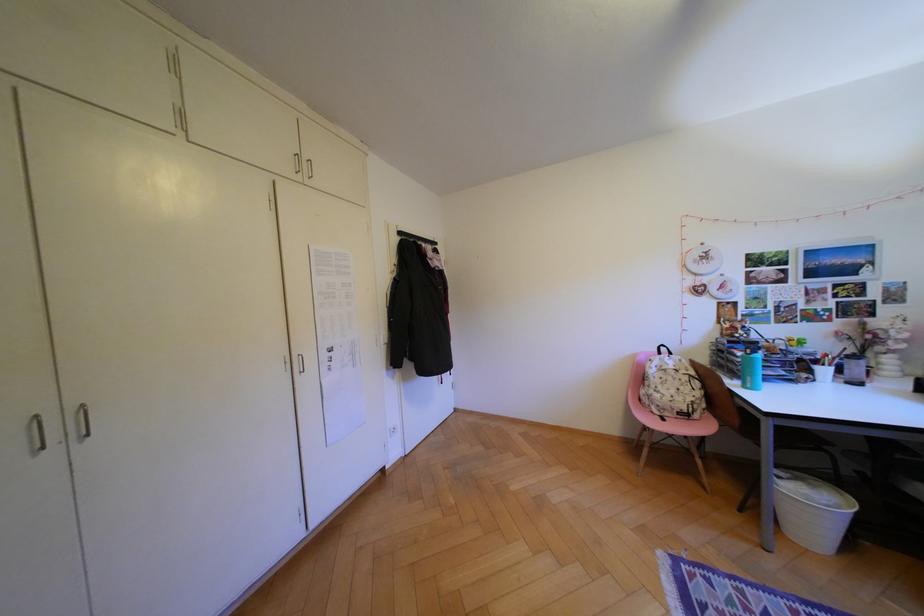
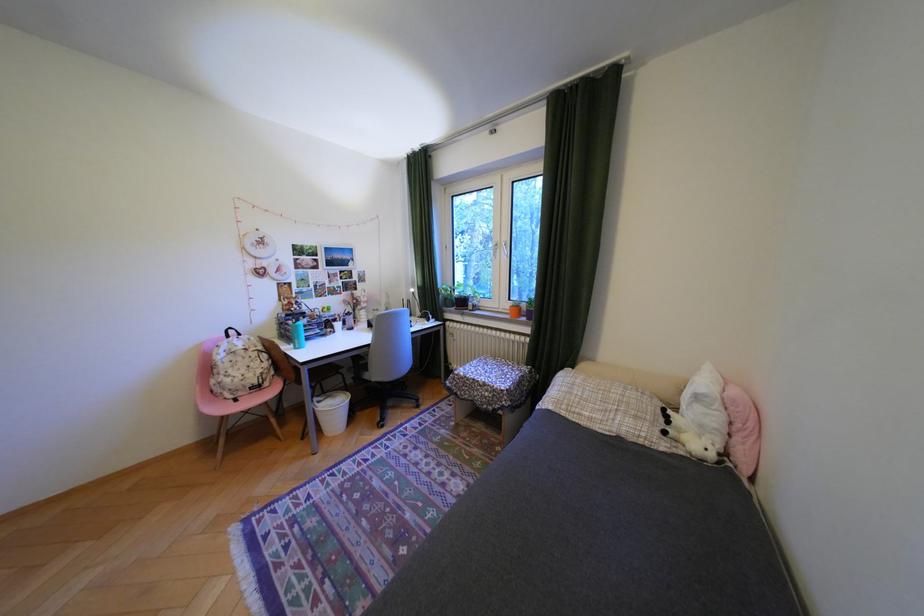
Find the pixel in the second image that matches point 791,477 in the first image.

(331, 402)